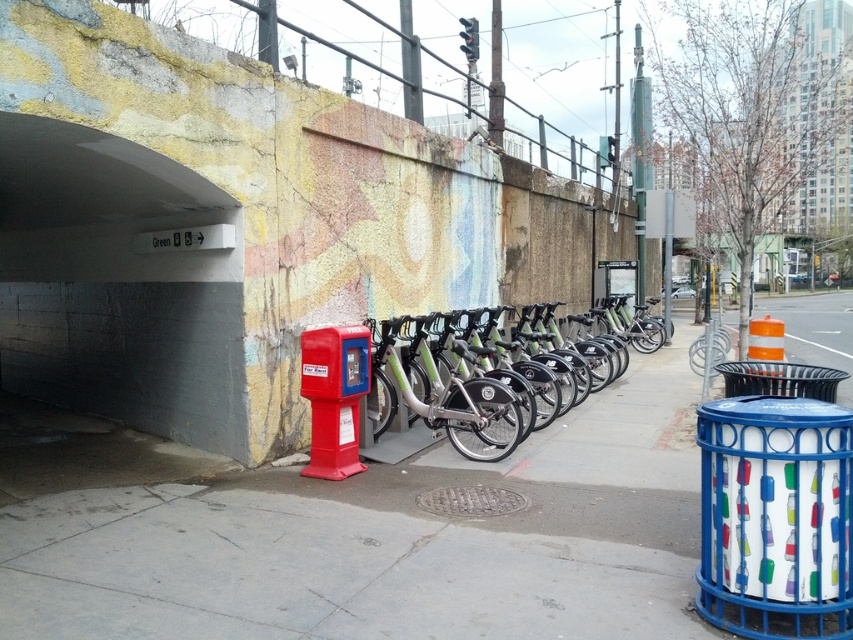
You are a delivery person trying to maneuver a 1.2 meter wide cart through the gray concrete sidewalk at center where there is a silver metallic bicycle at center. Can you pass through without moving the bicycle?

The gray concrete sidewalk at center might be wider than silver metallic bicycle at center, so there is a possibility that the 1.2 meter wide cart can pass through without moving the bicycle, but it depends on the actual width difference.

You are standing at the entrance of the underpass and want to reach the gray concrete sidewalk at center. Which direction should you walk to get there?

The gray concrete sidewalk at center is located at point 0.845 in the x and 0.458 in the y coordinates. Since you are at the entrance of the underpass, you should walk forward towards the center of the image to reach the gray concrete sidewalk at center.